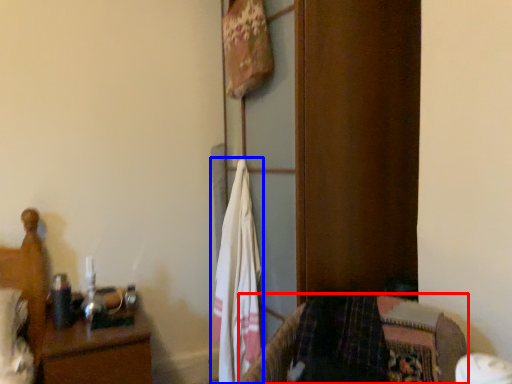
Question: Among these objects, which one is nearest to the camera, furniture (highlighted by a red box) or laundry (highlighted by a blue box)?

Choices:
 (A) furniture
 (B) laundry

Answer: (A)